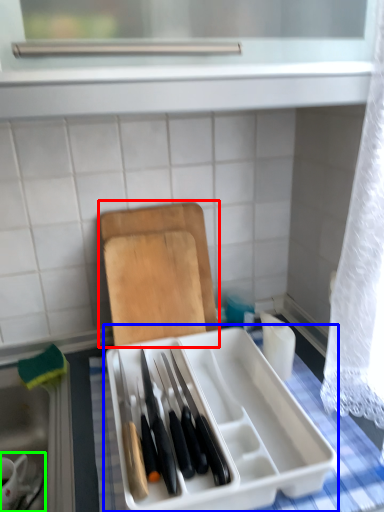
Question: Estimate the real-world distances between objects in this image. Which object is closer to cutting board (highlighted by a red box), appliance (highlighted by a blue box) or tableware (highlighted by a green box)?

Choices:
 (A) appliance
 (B) tableware

Answer: (A)